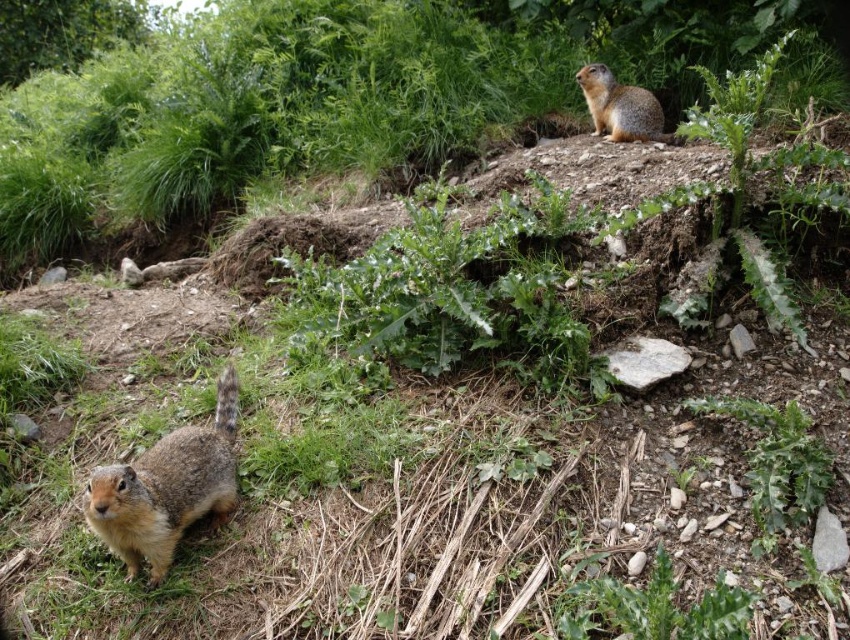
You are standing in the natural outdoor setting depicted in the image. You want to toss a small treat to the brown fur squirrel at lower left. If your throwing distance is 2 meters, will you be able to reach the squirrel?

The brown fur squirrel at lower left and viewer are 1.91 meters apart. Since your throwing distance is 2 meters, you can reach the squirrel.

You are a photographer trying to capture a photo of the two squirrels. You want to position your camera so that the green leafy plants at upper center are exactly in the center of your viewfinder. Given their 2D coordinates, where should you aim your camera relative to the plants?

The green leafy plants at upper center are located at coordinates point (259, 116). To center them in the viewfinder, aim the camera directly at those coordinates so the plants are exactly in the center.